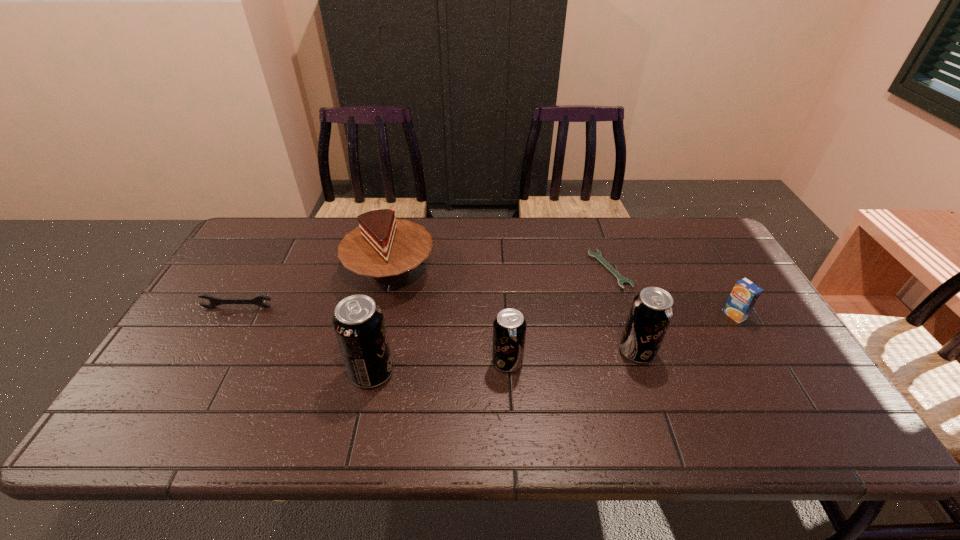
Find the location of `the leftmost soda can`. the leftmost soda can is located at coordinates (358, 322).

This screenshot has width=960, height=540. I want to click on the second soda can from right to left, so click(x=509, y=327).

Where is `the shortest soda can`? The image size is (960, 540). the shortest soda can is located at coordinates (509, 327).

You are a GUI agent. You are given a task and a screenshot of the screen. Output one action in this format:
    pyautogui.click(x=<x>, y=<y>)
    Task: Click on the second tallest soda can
    The width and height of the screenshot is (960, 540).
    Given the screenshot: What is the action you would take?
    pyautogui.click(x=652, y=309)

Where is `cake`? cake is located at coordinates coord(382,247).

Identify the location of the fifth tallest object. The width and height of the screenshot is (960, 540). (745, 294).

Locate an element on the screen. This screenshot has height=540, width=960. orange_juice is located at coordinates (745, 294).

You are a GUI agent. You are given a task and a screenshot of the screen. Output one action in this format:
    pyautogui.click(x=<x>, y=<y>)
    Task: Click on the shorter wrench
    
    Given the screenshot: What is the action you would take?
    pyautogui.click(x=621, y=280)

You are a GUI agent. You are given a task and a screenshot of the screen. Output one action in this format:
    pyautogui.click(x=<x>, y=<y>)
    Task: Click on the shortest object
    Image resolution: width=960 pixels, height=540 pixels.
    Given the screenshot: What is the action you would take?
    pyautogui.click(x=621, y=280)

Identify the location of the sixth tallest object. (257, 300).